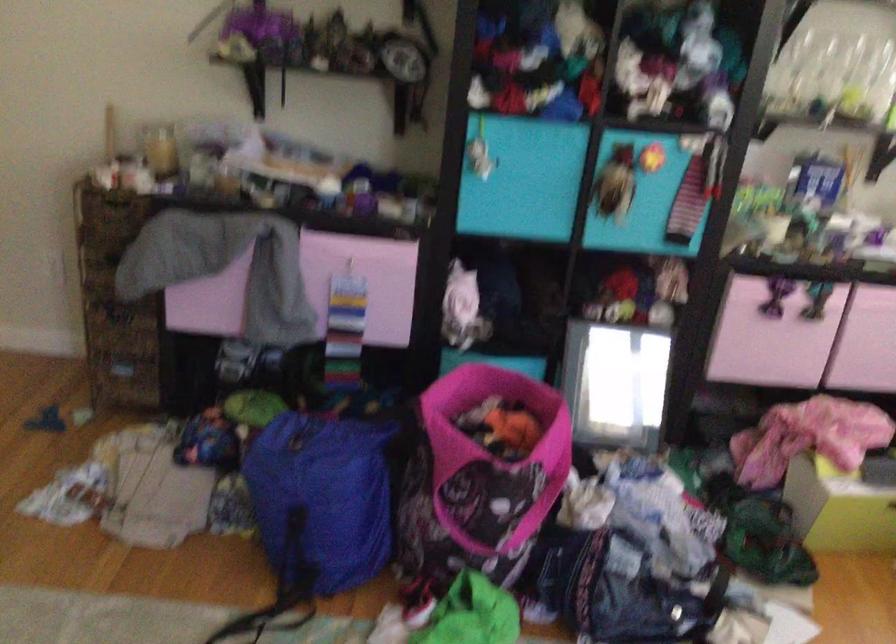
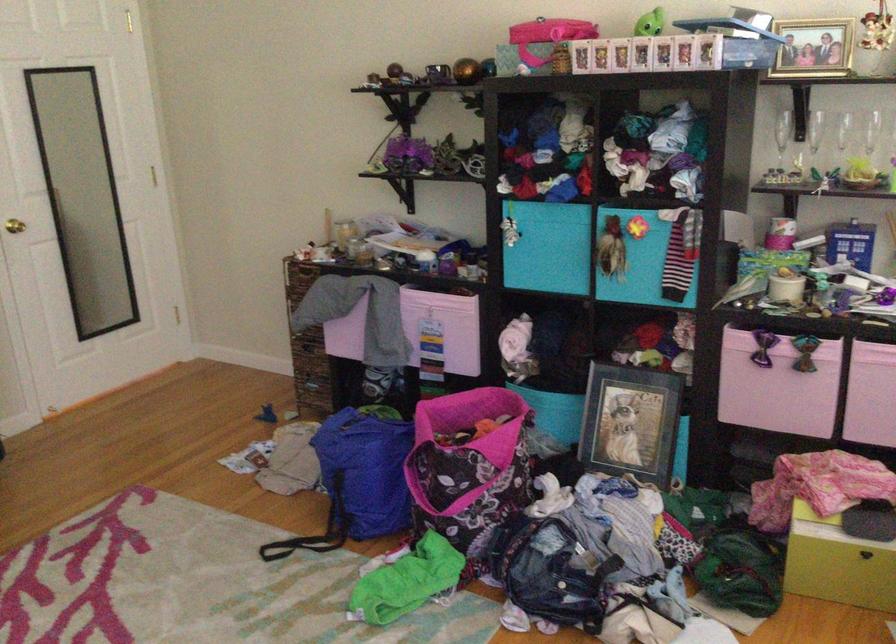
Locate, in the second image, the point that corresponds to (806,68) in the first image.

(814, 140)